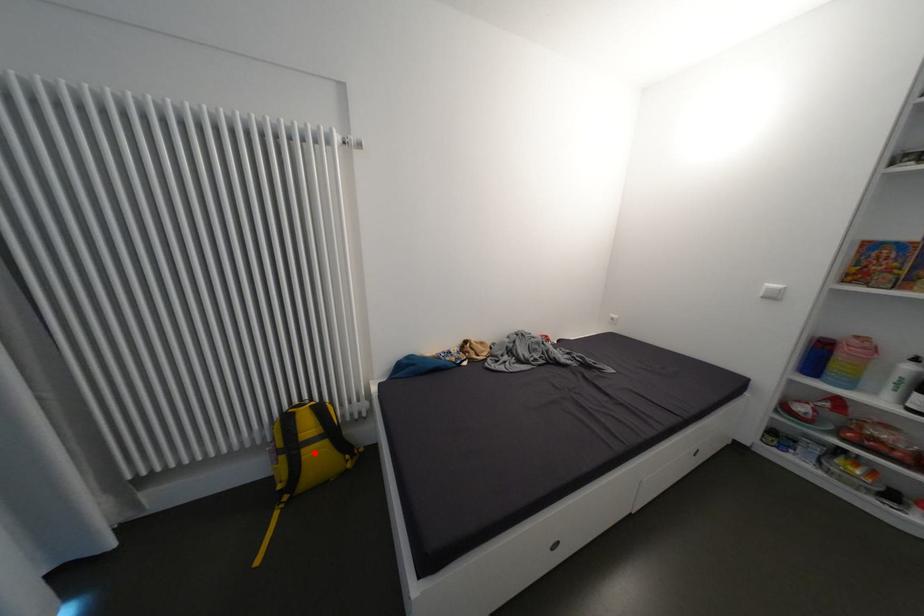
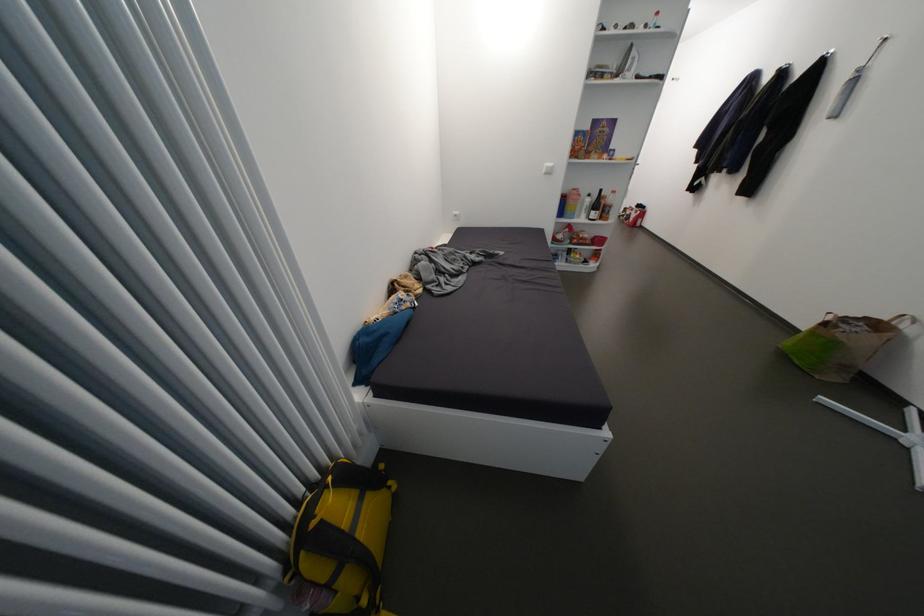
Where in the second image is the point corresponding to the highlighted location from the first image?

(370, 533)